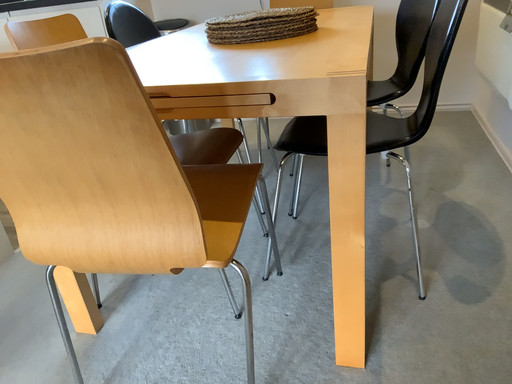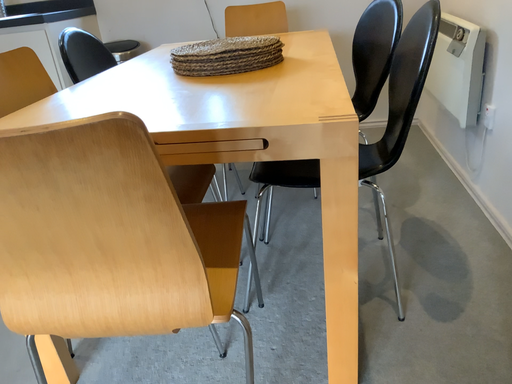
Question: How did the camera likely rotate when shooting the video?

Choices:
 (A) rotated right
 (B) rotated left

Answer: (A)